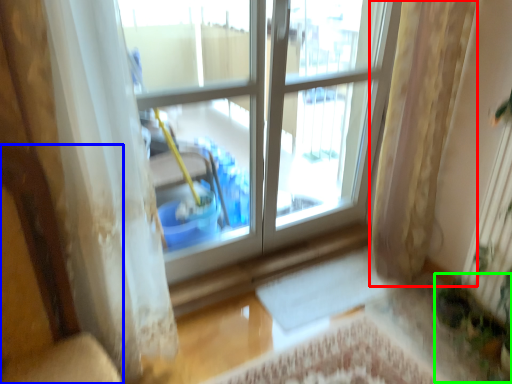
Question: Which is nearer to the curtain (highlighted by a red box)? armchair (highlighted by a blue box) or plant (highlighted by a green box).

Choices:
 (A) armchair
 (B) plant

Answer: (B)